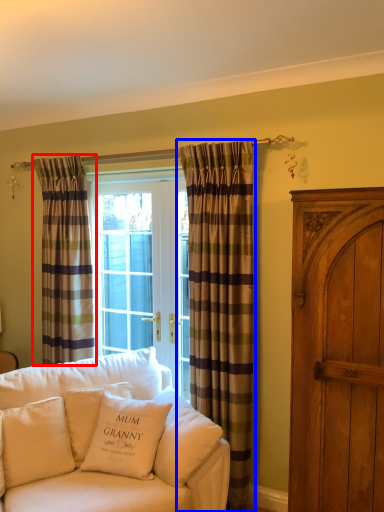
Question: Which object is further to the camera taking this photo, curtain (highlighted by a red box) or curtain (highlighted by a blue box)?

Choices:
 (A) curtain
 (B) curtain

Answer: (A)